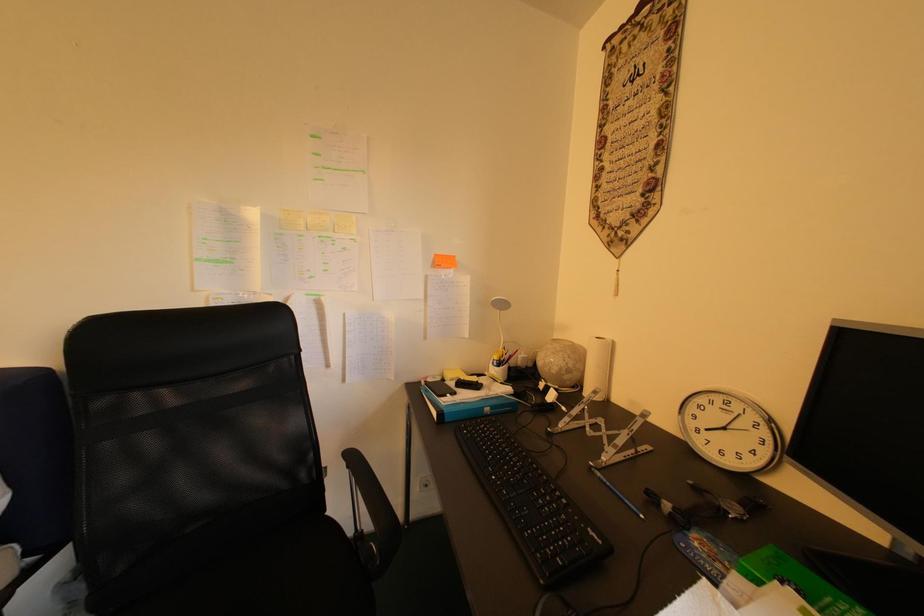
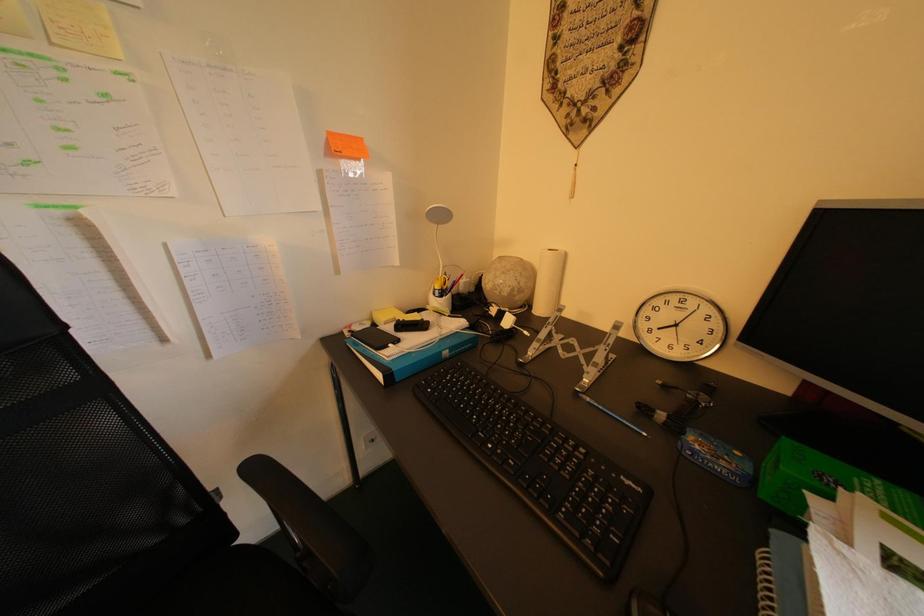
Question: What movement of the cameraman would produce the second image?

Choices:
 (A) Left
 (B) Right
 (C) Forward
 (D) Backward

Answer: (C)